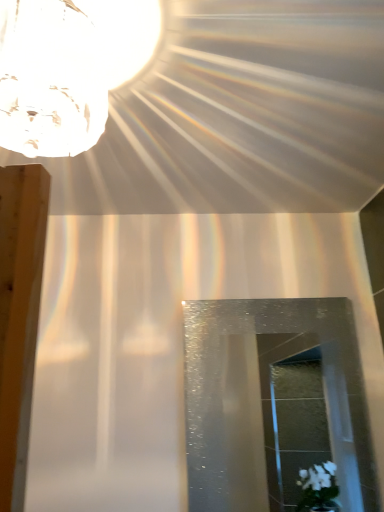
Question: Does transparent textured glass door at center have a lesser height compared to crystal glass lampshade at upper left?

Choices:
 (A) yes
 (B) no

Answer: (B)

Question: Does transparent textured glass door at center lie in front of crystal glass lampshade at upper left?

Choices:
 (A) yes
 (B) no

Answer: (B)

Question: Is transparent textured glass door at center positioned behind crystal glass lampshade at upper left?

Choices:
 (A) no
 (B) yes

Answer: (B)

Question: Considering the relative positions of transparent textured glass door at center and crystal glass lampshade at upper left in the image provided, is transparent textured glass door at center to the right of crystal glass lampshade at upper left from the viewer's perspective?

Choices:
 (A) yes
 (B) no

Answer: (A)

Question: Does transparent textured glass door at center have a larger size compared to crystal glass lampshade at upper left?

Choices:
 (A) yes
 (B) no

Answer: (B)

Question: Is transparent textured glass door at center wider than crystal glass lampshade at upper left?

Choices:
 (A) yes
 (B) no

Answer: (B)

Question: From the image's perspective, would you say crystal glass lampshade at upper left is positioned over transparent textured glass door at center?

Choices:
 (A) yes
 (B) no

Answer: (A)

Question: Is crystal glass lampshade at upper left taller than transparent textured glass door at center?

Choices:
 (A) yes
 (B) no

Answer: (B)

Question: From the image's perspective, is crystal glass lampshade at upper left under transparent textured glass door at center?

Choices:
 (A) yes
 (B) no

Answer: (B)

Question: Is crystal glass lampshade at upper left aimed at transparent textured glass door at center?

Choices:
 (A) yes
 (B) no

Answer: (B)

Question: From a real-world perspective, is crystal glass lampshade at upper left positioned over transparent textured glass door at center based on gravity?

Choices:
 (A) yes
 (B) no

Answer: (A)

Question: Is crystal glass lampshade at upper left bigger than transparent textured glass door at center?

Choices:
 (A) no
 (B) yes

Answer: (B)

Question: From the image's perspective, is crystal glass lampshade at upper left above or below transparent textured glass door at center?

Choices:
 (A) below
 (B) above

Answer: (B)